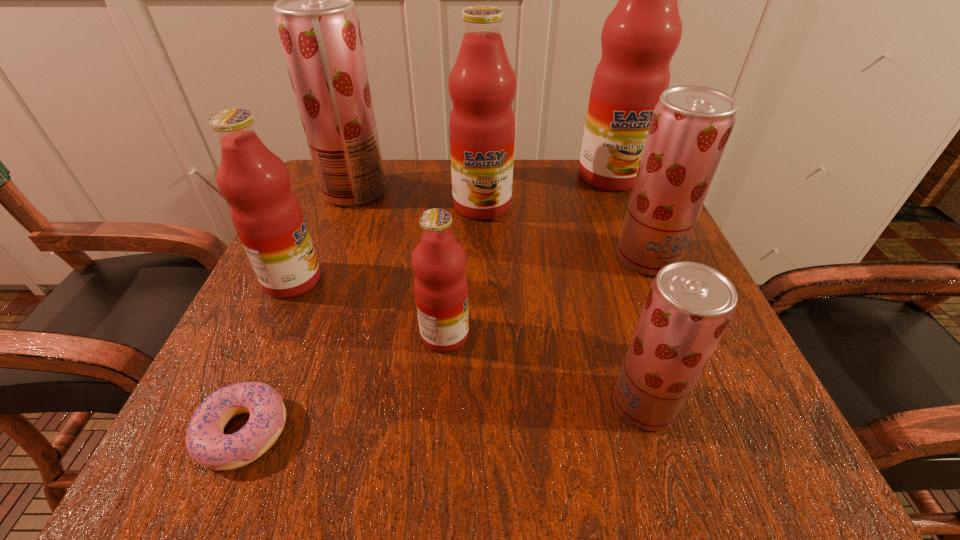
At what (x,y) coordinates should I click in order to perform the action: click on free space that satisfies the following two spatial constraints: 1. on the label of the second biggest pink fruit juice; 2. on the left side of the nearest fruit juice. Please return your answer as a coordinate pair (x, y). This screenshot has height=540, width=960. Looking at the image, I should click on (483, 404).

What are the coordinates of `vacant area in the image that satisfies the following two spatial constraints: 1. on the label of the second biggest pink fruit juice; 2. on the label of the leftmost pink fruit juice` in the screenshot? It's located at (482, 280).